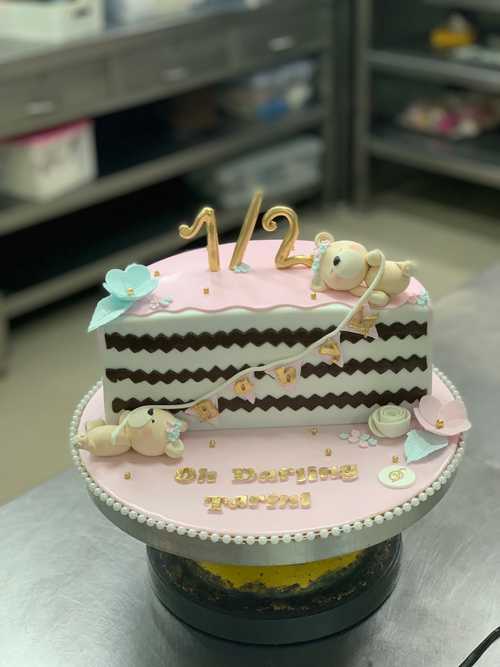
You are a GUI agent. You are given a task and a screenshot of the screen. Output one action in this format:
    pyautogui.click(x=<x>, y=<y>)
    Task: Click on the shelves
    
    Given the screenshot: What is the action you would take?
    pyautogui.click(x=127, y=153), pyautogui.click(x=66, y=241), pyautogui.click(x=477, y=163), pyautogui.click(x=405, y=41)